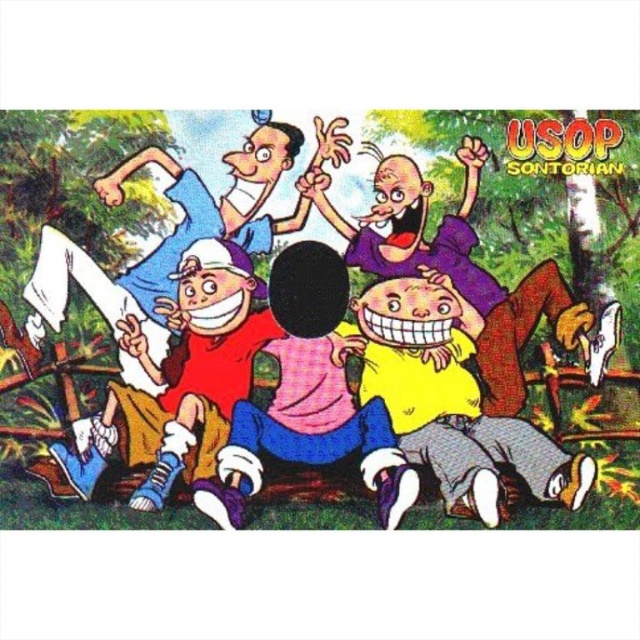
In the vibrant outdoor scene, there are two characters wearing a matte pink shirt at center and a smooth purple shirt at center. Which character is wearing the smaller shirt?

The matte pink shirt at center has a smaller size compared to the smooth purple shirt at center, so the character wearing the matte pink shirt at center has the smaller one.

You are trying to decide which shirt to wear for a picnic. Both the yellow matte shirt at center and the matte pink shirt at center are available. Which one has a larger size?

The yellow matte shirt at center is bigger than the matte pink shirt at center, so it has a larger size.

You are standing at the position of the character with the white cap, red shirt, and brown shorts. You want to hand a small object to the character wearing the matte pink shirt at center. Can you reach them without moving from your current position?

The characters are 3.57 meters apart. Since the distance is greater than an average person can reach, you cannot hand the object without moving closer.